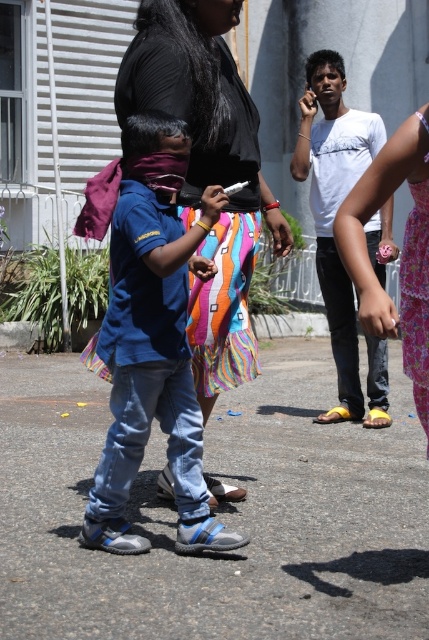
Question: Observing the image, what is the correct spatial positioning of blue denim jeans at center in reference to white matte shirt at center?

Choices:
 (A) above
 (B) below

Answer: (B)

Question: Is blue denim jeans at center positioned behind black fabric dress at center?

Choices:
 (A) yes
 (B) no

Answer: (B)

Question: Estimate the real-world distances between objects in this image. Which object is closer to the black fabric dress at center?

Choices:
 (A) white matte shirt at center
 (B) blue denim jeans at center

Answer: (B)

Question: Is blue denim jeans at center to the right of black fabric dress at center from the viewer's perspective?

Choices:
 (A) yes
 (B) no

Answer: (B)

Question: Among these objects, which one is nearest to the camera?

Choices:
 (A) blue denim jeans at center
 (B) black fabric dress at center
 (C) white matte shirt at center

Answer: (A)

Question: Among these objects, which one is nearest to the camera?

Choices:
 (A) white matte shirt at center
 (B) blue denim jeans at center

Answer: (B)